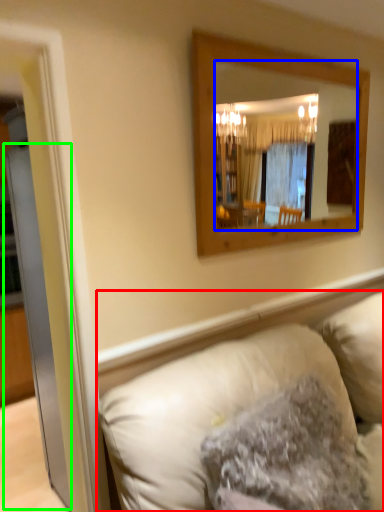
Question: Which object is the closest to the studio couch (highlighted by a red box)? Choose among these: mirror (highlighted by a blue box) or glass door (highlighted by a green box).

Choices:
 (A) mirror
 (B) glass door

Answer: (B)